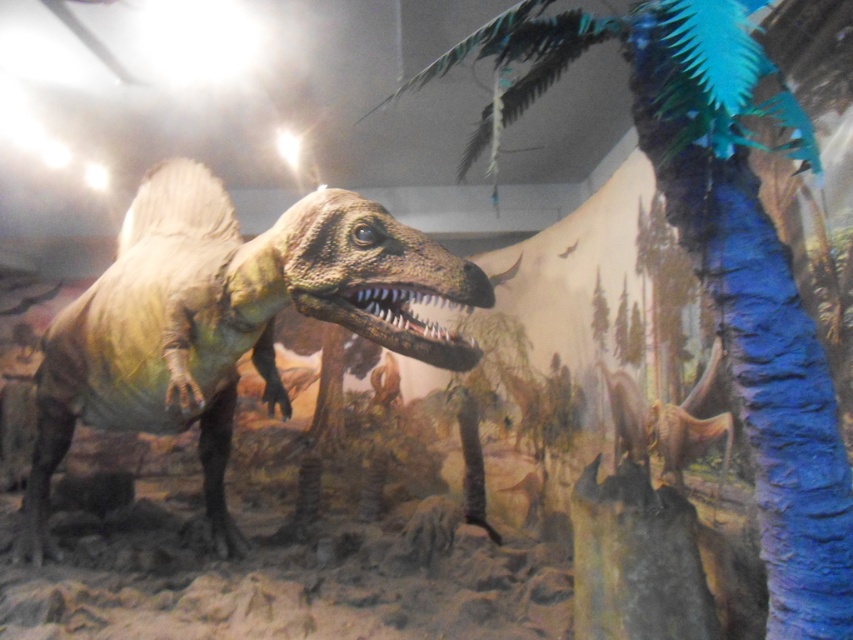
Which is below, blue feathered palm tree at center or shiny metallic dinosaur at center?

shiny metallic dinosaur at center is below.

Looking at this image, is blue feathered palm tree at center below shiny metallic dinosaur at center?

No, blue feathered palm tree at center is not below shiny metallic dinosaur at center.

Is point (763, 385) in front of point (331, 230)?

Yes, point (763, 385) is in front of point (331, 230).

The height and width of the screenshot is (640, 853). I want to click on blue feathered palm tree at center, so click(720, 257).